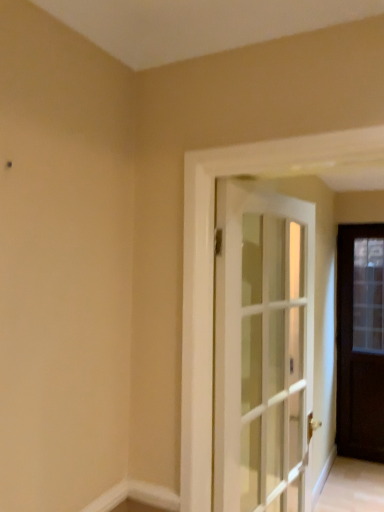
Question: From a real-world perspective, relative to dark wood door at right, the 1th door positioned from the back, is white smooth baseboard at lower center vertically above or below?

Choices:
 (A) below
 (B) above

Answer: (A)

Question: Considering the relative positions of white smooth baseboard at lower center and dark wood door at right, the 1th door positioned from the back, in the image provided, is white smooth baseboard at lower center to the left or to the right of dark wood door at right, the 1th door positioned from the back,?

Choices:
 (A) left
 (B) right

Answer: (A)

Question: Estimate the real-world distances between objects in this image. Which object is farther from the white glass door at center, which ranks as the first door in front-to-back order?

Choices:
 (A) white smooth baseboard at lower center
 (B) dark wood door at right, arranged as the first door when viewed from the right

Answer: (B)

Question: Which of these objects is positioned closest to the white glass door at center, acting as the second door starting from the right?

Choices:
 (A) dark wood door at right, arranged as the first door when viewed from the right
 (B) white smooth baseboard at lower center

Answer: (B)